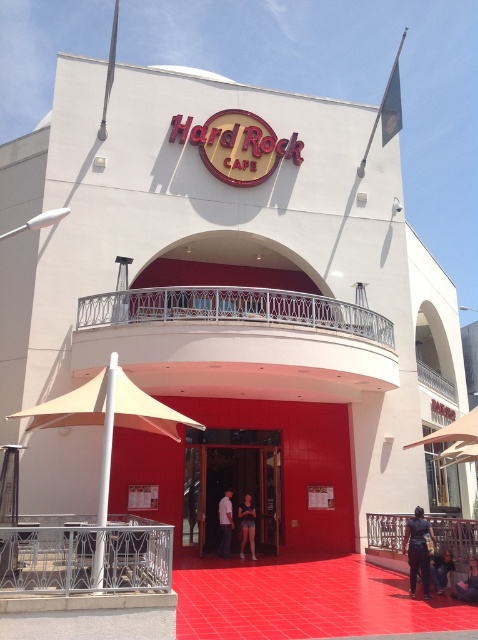
You are a delivery person trying to deliver a package to the Hard Rock Cafe entrance. You see the smooth glass door at center and the white cotton shirt at center. Which object is taller?

The white cotton shirt at center is taller than the smooth glass door at center.

You are a customer entering the Hard Rock Cafe and see a person wearing a white cotton shirt at center and dark blue jeans at lower right. Which piece of clothing is closer to the entrance?

The white cotton shirt at center is positioned on the left side of dark blue jeans at lower right, so the white cotton shirt at center is closer to the entrance.